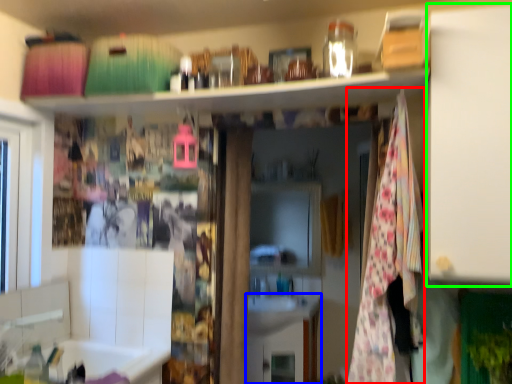
Question: Which object is the farthest from blanket (highlighted by a red box)? Choose among these: cabinetry (highlighted by a blue box) or cabinet (highlighted by a green box).

Choices:
 (A) cabinetry
 (B) cabinet

Answer: (A)